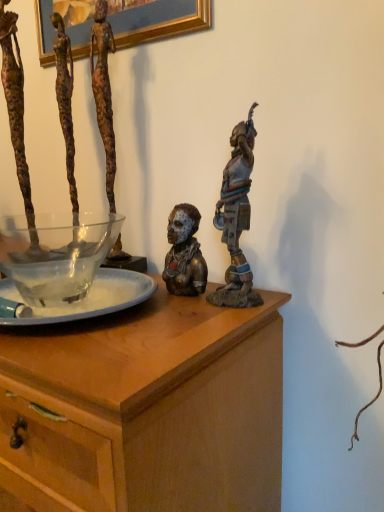
Question: Considering the relative sizes of rusty metal sculpture at left, which ranks as the first person in left-to-right order, and bronze statue at upper right, acting as the 1th person starting from the right, in the image provided, is rusty metal sculpture at left, which ranks as the first person in left-to-right order, taller than bronze statue at upper right, acting as the 1th person starting from the right,?

Choices:
 (A) yes
 (B) no

Answer: (A)

Question: From the image's perspective, does rusty metal sculpture at left, which is the 4th person in right-to-left order, appear lower than bronze statue at upper right, which ranks as the 4th person in left-to-right order?

Choices:
 (A) no
 (B) yes

Answer: (A)

Question: From a real-world perspective, is rusty metal sculpture at left, which ranks as the first person in left-to-right order, positioned under bronze statue at upper right, which ranks as the 4th person in left-to-right order, based on gravity?

Choices:
 (A) yes
 (B) no

Answer: (B)

Question: Does rusty metal sculpture at left, which is the 4th person in right-to-left order, touch bronze statue at upper right, which ranks as the 4th person in left-to-right order?

Choices:
 (A) no
 (B) yes

Answer: (A)

Question: Can you confirm if rusty metal sculpture at left, which is the 4th person in right-to-left order, is wider than bronze statue at upper right, which ranks as the 4th person in left-to-right order?

Choices:
 (A) yes
 (B) no

Answer: (A)

Question: From their relative heights in the image, would you say rusty metal sculpture at left, which is the 4th person in right-to-left order, is taller or shorter than bronze statue at center, acting as the third person starting from the left?

Choices:
 (A) short
 (B) tall

Answer: (B)

Question: Is rusty metal sculpture at left, which is the 4th person in right-to-left order, in front of or behind bronze statue at center, acting as the third person starting from the left, in the image?

Choices:
 (A) behind
 (B) front

Answer: (A)

Question: Considering the positions of rusty metal sculpture at left, which ranks as the first person in left-to-right order, and bronze statue at center, acting as the third person starting from the left, in the image, is rusty metal sculpture at left, which ranks as the first person in left-to-right order, wider or thinner than bronze statue at center, acting as the third person starting from the left,?

Choices:
 (A) thin
 (B) wide

Answer: (B)

Question: Would you say rusty metal sculpture at left, which ranks as the first person in left-to-right order, is inside or outside bronze statue at center, acting as the third person starting from the left?

Choices:
 (A) inside
 (B) outside

Answer: (B)

Question: In terms of height, does bronze statue at center, acting as the third person starting from the left, look taller or shorter compared to wooden chest at center?

Choices:
 (A) tall
 (B) short

Answer: (B)

Question: From a real-world perspective, is bronze statue at center, acting as the third person starting from the left, physically located above or below wooden chest at center?

Choices:
 (A) below
 (B) above

Answer: (B)

Question: Is bronze statue at center, acting as the third person starting from the left, inside the boundaries of wooden chest at center, or outside?

Choices:
 (A) outside
 (B) inside

Answer: (A)

Question: From the image's perspective, is bronze statue at center, the second person positioned from the right, above or below wooden chest at center?

Choices:
 (A) above
 (B) below

Answer: (A)

Question: Is translucent glass bowl at center to the left or to the right of bronze statue at upper right, acting as the 1th person starting from the right, in the image?

Choices:
 (A) right
 (B) left

Answer: (B)

Question: Is translucent glass bowl at center situated inside bronze statue at upper right, acting as the 1th person starting from the right, or outside?

Choices:
 (A) outside
 (B) inside

Answer: (A)